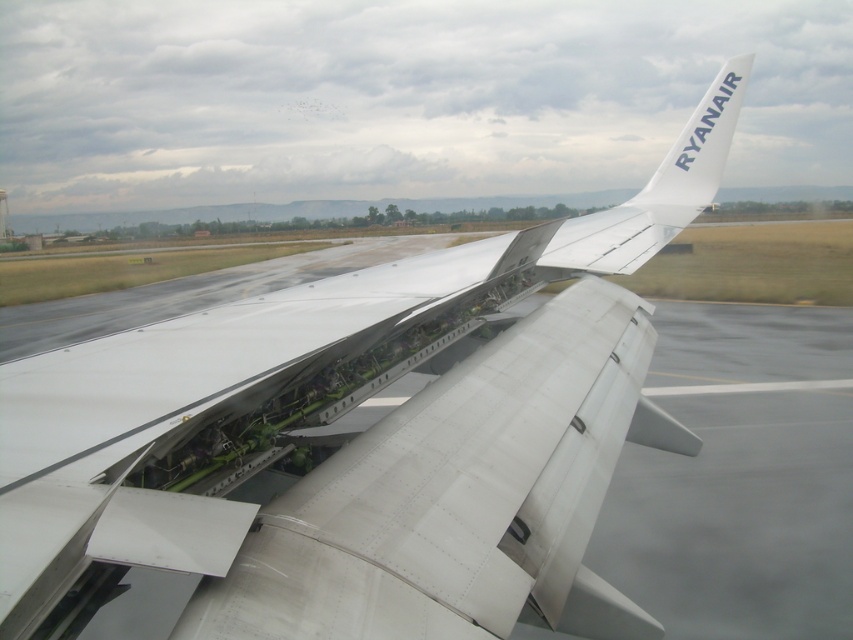
Can you confirm if white metallic wing at center is positioned below white matte airplane tail at upper right?

Indeed, white metallic wing at center is positioned under white matte airplane tail at upper right.

Which is more to the left, white metallic wing at center or white matte airplane tail at upper right?

Positioned to the left is white metallic wing at center.

Find the location of a particular element. Image resolution: width=853 pixels, height=640 pixels. white metallic wing at center is located at coordinates (457, 499).